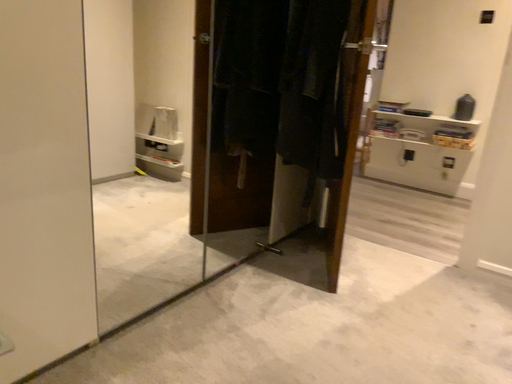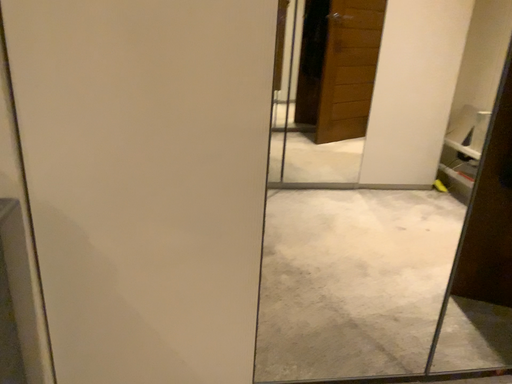
Question: How did the camera likely rotate when shooting the video?

Choices:
 (A) rotated downward
 (B) rotated upward

Answer: (B)